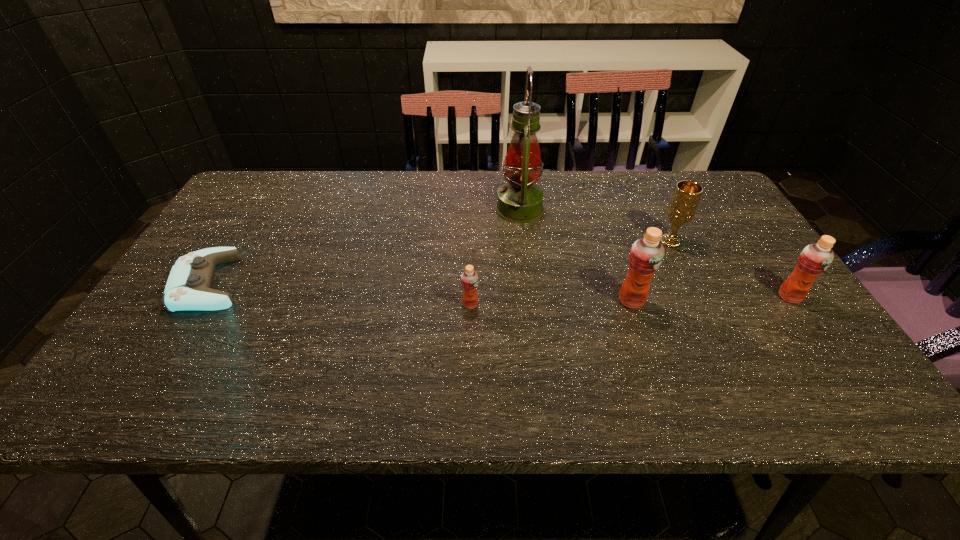
Locate an element on the screen. vacant space at the far edge is located at coordinates (440, 211).

In the image, there is a desktop. In order to click on free space at the near edge in this screenshot , I will do `click(201, 364)`.

In the image, there is a desktop. Find the location of `vacant space at the right edge`. vacant space at the right edge is located at coordinates (761, 293).

The image size is (960, 540). I want to click on vacant region at the far left corner of the desktop, so click(258, 186).

Image resolution: width=960 pixels, height=540 pixels. In order to click on vacant area that lies between the rightmost orange juice and the control in this screenshot , I will do `click(499, 290)`.

Where is `free spot between the rightmost orange juice and the chalice`? The height and width of the screenshot is (540, 960). free spot between the rightmost orange juice and the chalice is located at coordinates (730, 269).

This screenshot has width=960, height=540. In order to click on vacant area that lies between the leftmost object and the fifth nearest object in this screenshot , I will do `click(440, 262)`.

Find the location of a particular element. The height and width of the screenshot is (540, 960). vacant area that lies between the shortest object and the fifth nearest object is located at coordinates 440,262.

This screenshot has height=540, width=960. I want to click on free spot between the second shortest object and the oil lamp, so click(x=494, y=257).

The width and height of the screenshot is (960, 540). I want to click on free point between the fifth object from right to left and the farthest object, so click(494, 257).